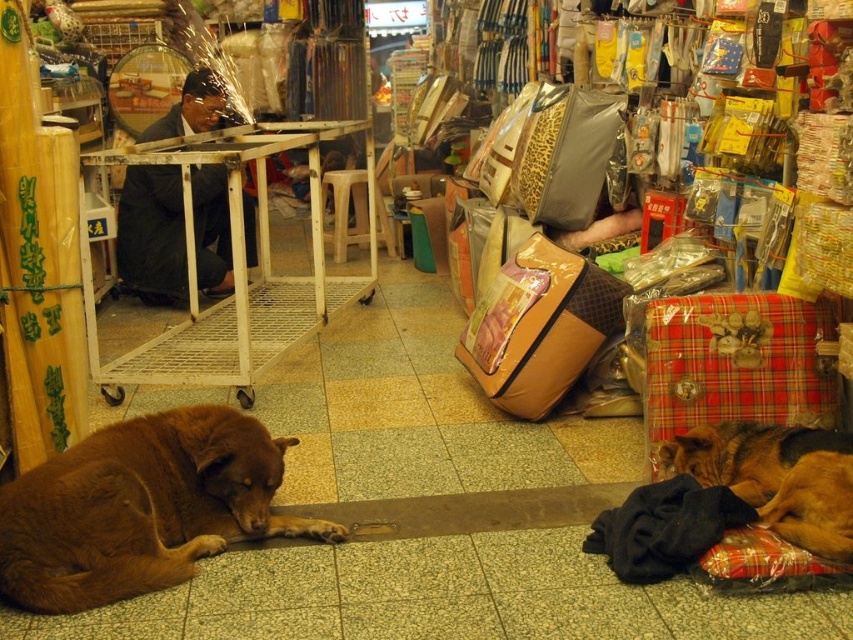
You are a customer in the market and want to place a small bag between the brown furry dog at lower left and the dark suit at center. Based on their heights, will the bag be visible above the shorter object?

The brown furry dog at lower left is shorter than the dark suit at center. Since the bag is placed between them, it will be visible above the brown furry dog at lower left but might be partially hidden by the taller dark suit at center.